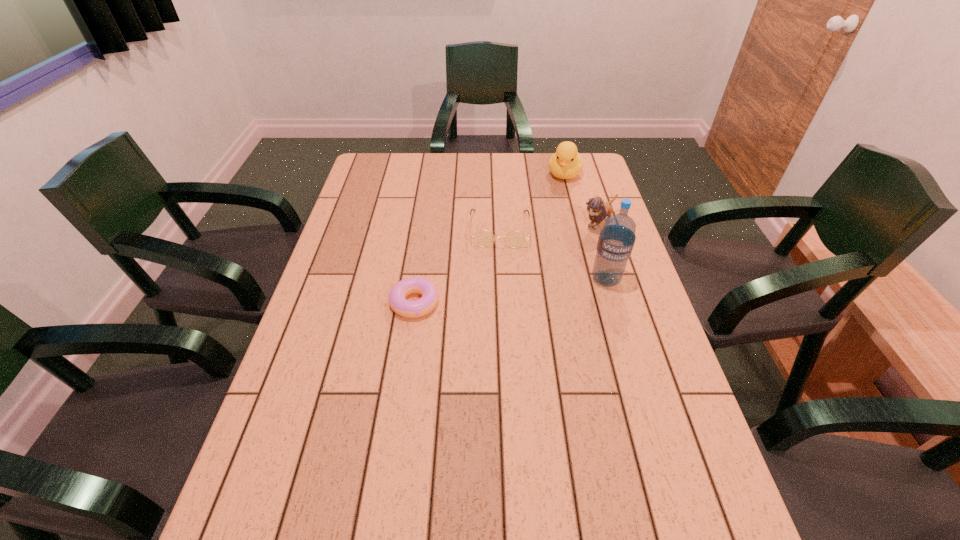
This screenshot has height=540, width=960. I want to click on vacant space situated 0.160m on the front-facing side of the second tallest object, so click(x=557, y=211).

Locate an element on the screen. vacant space located on the front-facing side of the second tallest object is located at coordinates (550, 240).

Image resolution: width=960 pixels, height=540 pixels. Find the location of `free spot located on the front-facing side of the second tallest object`. free spot located on the front-facing side of the second tallest object is located at coordinates (549, 244).

Identify the location of free space located 0.290m on the lenses of the second object from left to right. (499, 322).

In order to click on free spot located on the lenses of the second object from left to right in this screenshot , I will do `click(499, 286)`.

Identify the location of vacant space located on the lenses of the second object from left to right. (499, 355).

I want to click on vacant space located 0.220m on the front-facing side of the kitten, so click(x=544, y=266).

What are the coordinates of `blank area located on the front-facing side of the kitten` in the screenshot? It's located at (572, 244).

The image size is (960, 540). Identify the location of vacant region located on the front-facing side of the kitten. point(546,264).

This screenshot has width=960, height=540. In order to click on object that is at the far edge in this screenshot , I will do `click(566, 163)`.